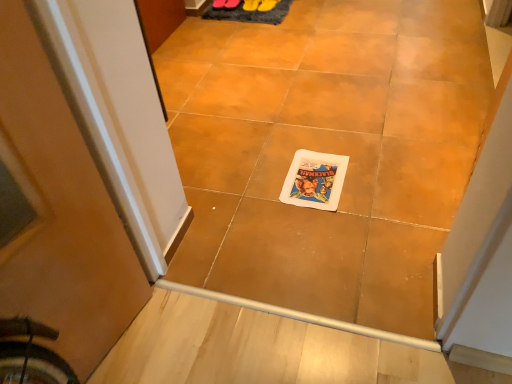
Describe the element at coordinates (250, 14) in the screenshot. I see `dark gray shaggy rug at upper center` at that location.

What is the approximate width of white matte tile at center?

white matte tile at center is 13.16 inches wide.

At what (x,y) coordinates should I click in order to perform the action: click on matte paper comic book at center. Please return your answer as a coordinate pair (x, y). This screenshot has height=384, width=512. Looking at the image, I should click on (315, 180).

The width and height of the screenshot is (512, 384). I want to click on dark gray shaggy rug at upper center, so click(250, 14).

Consider the image. Is yellow rubber boot at center, the 1th footwear viewed from the left, smaller than dark gray shaggy rug at upper center?

Correct, yellow rubber boot at center, the 1th footwear viewed from the left, occupies less space than dark gray shaggy rug at upper center.

Based on the photo, how many degrees apart are the facing directions of yellow rubber boot at center, which is counted as the second footwear, starting from the right, and dark gray shaggy rug at upper center?

5.42 degrees.

Looking at this image, can you confirm if yellow rubber boot at center, the 1th footwear viewed from the left, is taller than dark gray shaggy rug at upper center?

No, yellow rubber boot at center, the 1th footwear viewed from the left, is not taller than dark gray shaggy rug at upper center.

From the picture: Is yellow rubber boot at center, the 1th footwear viewed from the left, looking in the opposite direction of dark gray shaggy rug at upper center?

No, yellow rubber boot at center, the 1th footwear viewed from the left, is not facing away from dark gray shaggy rug at upper center.

Is the surface of rubber yellow shoe at upper center, which is the second footwear in left-to-right order, in direct contact with yellow rubber boot at center, which is counted as the second footwear, starting from the right?

Yes, rubber yellow shoe at upper center, which is the second footwear in left-to-right order, is right next to yellow rubber boot at center, which is counted as the second footwear, starting from the right, and making contact.

From the image's perspective, is rubber yellow shoe at upper center, which is the second footwear in left-to-right order, positioned above or below yellow rubber boot at center, the 1th footwear viewed from the left?

rubber yellow shoe at upper center, which is the second footwear in left-to-right order, is below yellow rubber boot at center, the 1th footwear viewed from the left.

Is rubber yellow shoe at upper center, which is the second footwear in left-to-right order, aimed at yellow rubber boot at center, which is counted as the second footwear, starting from the right?

Yes, rubber yellow shoe at upper center, which is the second footwear in left-to-right order, is facing yellow rubber boot at center, which is counted as the second footwear, starting from the right.

Is rubber yellow shoe at upper center, which is the second footwear in left-to-right order, to the left of yellow rubber boot at center, which is counted as the second footwear, starting from the right, from the viewer's perspective?

No, rubber yellow shoe at upper center, which is the second footwear in left-to-right order, is not to the left of yellow rubber boot at center, which is counted as the second footwear, starting from the right.

Does dark gray shaggy rug at upper center have a greater width compared to white matte tile at center?

Yes.

From a real-world perspective, does dark gray shaggy rug at upper center sit lower than white matte tile at center?

Correct, in the physical world, dark gray shaggy rug at upper center is lower than white matte tile at center.

In the scene shown: Measure the distance from dark gray shaggy rug at upper center to white matte tile at center.

They are 94.71 centimeters apart.

Locate an element on the screen. doormat below the white matte tile at center (from a real-world perspective) is located at coordinates (250, 14).

Can you confirm if matte paper comic book at center is positioned to the left of dark gray shaggy rug at upper center?

In fact, matte paper comic book at center is to the right of dark gray shaggy rug at upper center.

From a real-world perspective, is matte paper comic book at center physically located above or below dark gray shaggy rug at upper center?

matte paper comic book at center is situated higher than dark gray shaggy rug at upper center in the real world.

Considering the relative positions of matte paper comic book at center and dark gray shaggy rug at upper center in the image provided, is matte paper comic book at center behind dark gray shaggy rug at upper center?

No, matte paper comic book at center is closer to the camera.

Which is farther from the camera, [327,209] or [274,16]?

The point [274,16] is farther.

Which of these two, white matte tile at center or dark gray shaggy rug at upper center, stands shorter?

dark gray shaggy rug at upper center.

Is white matte tile at center situated inside dark gray shaggy rug at upper center or outside?

white matte tile at center is not enclosed by dark gray shaggy rug at upper center.

This screenshot has height=384, width=512. In order to click on ceramic tile that appears below the dark gray shaggy rug at upper center (from the image's perspective) in this screenshot , I will do click(x=327, y=151).

Considering the positions of objects white matte tile at center and dark gray shaggy rug at upper center in the image provided, who is behind, white matte tile at center or dark gray shaggy rug at upper center?

dark gray shaggy rug at upper center.

From a real-world perspective, is yellow rubber boot at center, which is counted as the second footwear, starting from the right, positioned over rubber yellow shoe at upper center, the 1th footwear when ordered from right to left, based on gravity?

No.

Between yellow rubber boot at center, the 1th footwear viewed from the left, and rubber yellow shoe at upper center, the 1th footwear when ordered from right to left, which one has smaller width?

With smaller width is yellow rubber boot at center, the 1th footwear viewed from the left.

Is point (246, 0) farther from viewer compared to point (262, 8)?

No.

From the picture: Considering the positions of objects yellow rubber boot at center, which is counted as the second footwear, starting from the right, and rubber yellow shoe at upper center, which is the second footwear in left-to-right order, in the image provided, who is more to the left, yellow rubber boot at center, which is counted as the second footwear, starting from the right, or rubber yellow shoe at upper center, which is the second footwear in left-to-right order,?

yellow rubber boot at center, which is counted as the second footwear, starting from the right, is more to the left.

Which is behind, point (200, 234) or point (247, 8)?

The point (247, 8) is farther.

From a real-world perspective, who is located higher, white matte tile at center or yellow rubber boot at center, the 1th footwear viewed from the left?

white matte tile at center, from a real-world perspective.

From the picture: From the image's perspective, is white matte tile at center beneath yellow rubber boot at center, which is counted as the second footwear, starting from the right?

Yes, from the image's perspective, white matte tile at center is beneath yellow rubber boot at center, which is counted as the second footwear, starting from the right.

From a real-world perspective, starting from the dark gray shaggy rug at upper center, which footwear is the 1st one vertically above it? Please provide its 2D coordinates.

[(251, 5)]

Where is `footwear above the rubber yellow shoe at upper center, which is the second footwear in left-to-right order (from the image's perspective)`? footwear above the rubber yellow shoe at upper center, which is the second footwear in left-to-right order (from the image's perspective) is located at coordinates (251, 5).

When comparing their distances from rubber yellow shoe at upper center, which is the second footwear in left-to-right order, does yellow rubber boot at center, the 1th footwear viewed from the left, or dark gray shaggy rug at upper center seem closer?

yellow rubber boot at center, the 1th footwear viewed from the left, is positioned closer to the anchor rubber yellow shoe at upper center, which is the second footwear in left-to-right order.

From the image, which object appears to be farther from matte paper comic book at center, yellow rubber boot at center, which is counted as the second footwear, starting from the right, or white matte tile at center?

yellow rubber boot at center, which is counted as the second footwear, starting from the right, is further to matte paper comic book at center.

Estimate the real-world distances between objects in this image. Which object is closer to dark gray shaggy rug at upper center, white matte tile at center or rubber yellow shoe at upper center, which is the second footwear in left-to-right order?

The object closer to dark gray shaggy rug at upper center is rubber yellow shoe at upper center, which is the second footwear in left-to-right order.

From the image, which object appears to be farther from white matte tile at center, rubber yellow shoe at upper center, the 1th footwear when ordered from right to left, or dark gray shaggy rug at upper center?

rubber yellow shoe at upper center, the 1th footwear when ordered from right to left, lies further to white matte tile at center than the other object.

In the scene shown: When comparing their distances from matte paper comic book at center, does dark gray shaggy rug at upper center or white matte tile at center seem closer?

The object closer to matte paper comic book at center is white matte tile at center.

Estimate the real-world distances between objects in this image. Which object is further from white matte tile at center, dark gray shaggy rug at upper center or yellow rubber boot at center, the 1th footwear viewed from the left?

yellow rubber boot at center, the 1th footwear viewed from the left, lies further to white matte tile at center than the other object.

Considering their positions, is dark gray shaggy rug at upper center positioned closer to matte paper comic book at center than rubber yellow shoe at upper center, the 1th footwear when ordered from right to left?

dark gray shaggy rug at upper center is closer to matte paper comic book at center.

Which object lies nearer to the anchor point dark gray shaggy rug at upper center, matte paper comic book at center or yellow rubber boot at center, which is counted as the second footwear, starting from the right?

yellow rubber boot at center, which is counted as the second footwear, starting from the right.

Identify the location of doormat between white matte tile at center and yellow rubber boot at center, the 1th footwear viewed from the left, from front to back. (250, 14).

At what (x,y) coordinates should I click in order to perform the action: click on comic book character between white matte tile at center and dark gray shaggy rug at upper center along the z-axis. Please return your answer as a coordinate pair (x, y). The height and width of the screenshot is (384, 512). Looking at the image, I should click on (315, 180).

Identify the location of doormat between white matte tile at center and rubber yellow shoe at upper center, the 1th footwear when ordered from right to left, along the z-axis. This screenshot has height=384, width=512. (250, 14).

Image resolution: width=512 pixels, height=384 pixels. What are the coordinates of `comic book character positioned between white matte tile at center and rubber yellow shoe at upper center, which is the second footwear in left-to-right order, from near to far` in the screenshot? It's located at coord(315,180).